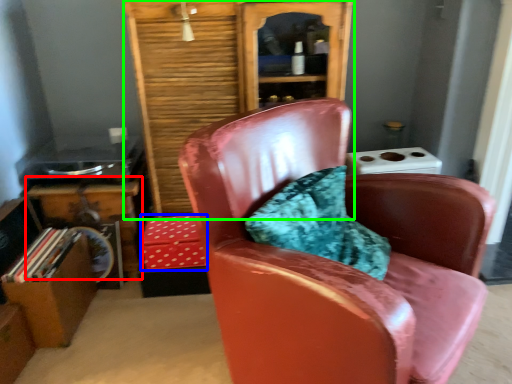
Question: Which object is positioned farthest from table (highlighted by a red box)? Select from box (highlighted by a blue box) and bookcase (highlighted by a green box).

Choices:
 (A) box
 (B) bookcase

Answer: (B)